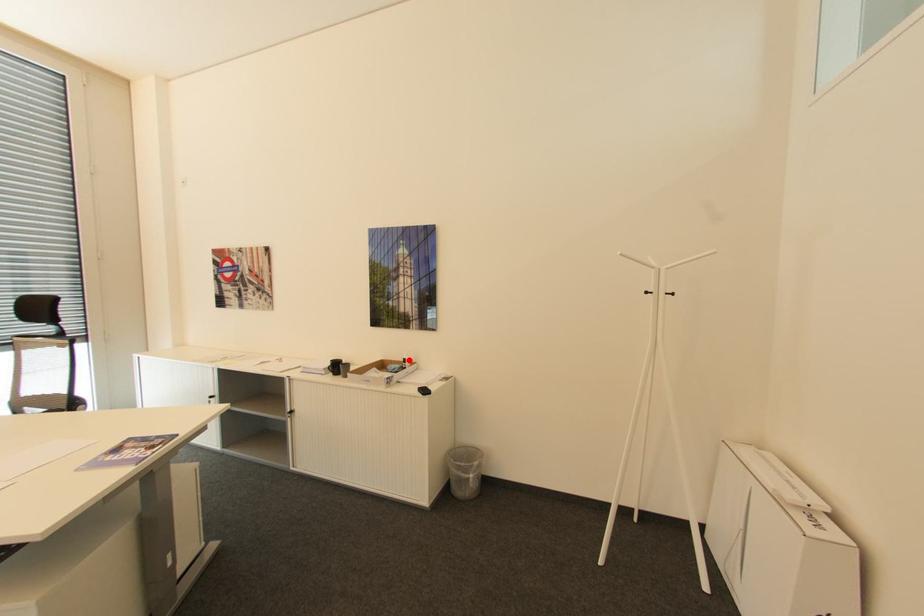
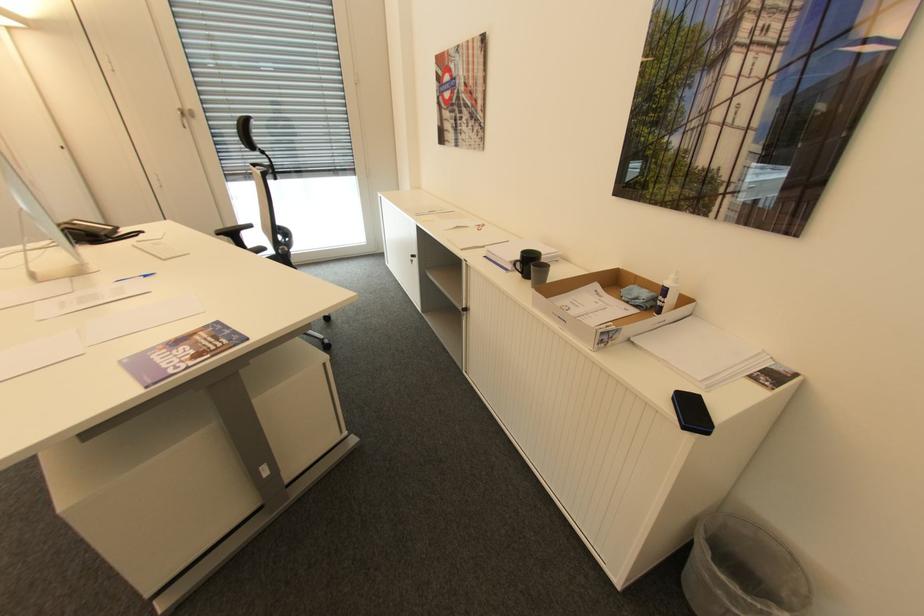
Find the pixel in the second image that matches the highlighted location in the first image.

(670, 291)